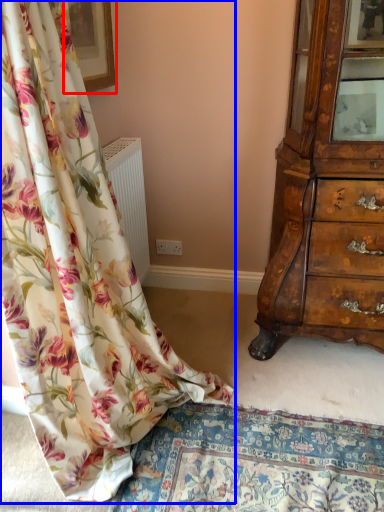
Question: Which object appears closest to the camera in this image, picture frame (highlighted by a red box) or curtain (highlighted by a blue box)?

Choices:
 (A) picture frame
 (B) curtain

Answer: (B)